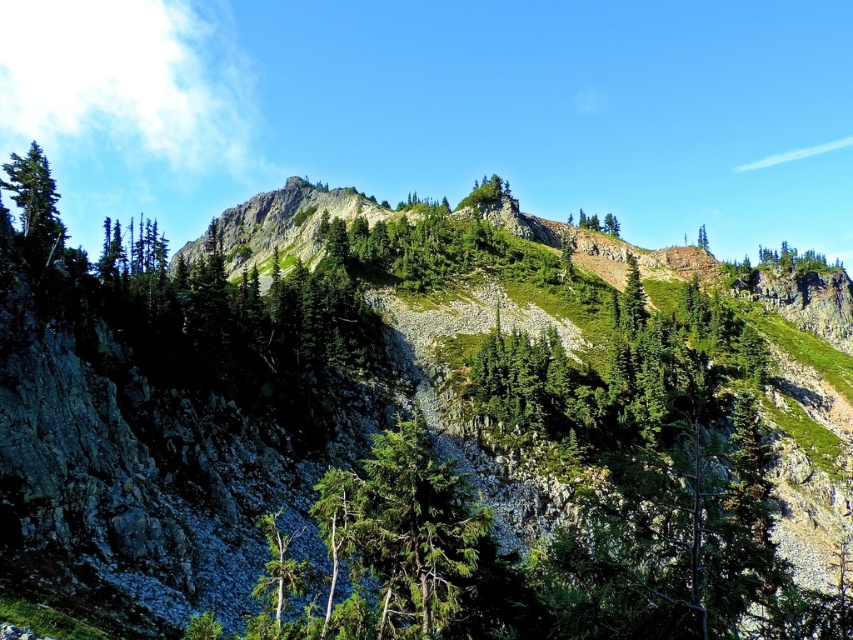
Can you confirm if green matte tree at upper left is positioned to the left of green matte tree at upper center?

Correct, you'll find green matte tree at upper left to the left of green matte tree at upper center.

Does green matte tree at upper left come behind green matte tree at upper center?

No.

Where is `green matte tree at upper left`? This screenshot has height=640, width=853. green matte tree at upper left is located at coordinates (35, 202).

At what (x,y) coordinates should I click in order to perform the action: click on green matte tree at lower center. Please return your answer as a coordinate pair (x, y). The image size is (853, 640). Looking at the image, I should click on (277, 579).

Which is behind, point (282, 556) or point (612, 214)?

The point (612, 214) is behind.

Identify the location of green matte tree at lower center. (277, 579).

Does point (596, 230) lie in front of point (697, 243)?

No, it is behind (697, 243).

Who is lower down, green leafy tree at upper center or green matte tree at upper center?

green matte tree at upper center is lower down.

Is point (584, 220) positioned behind point (703, 225)?

No, (584, 220) is in front of (703, 225).

I want to click on green leafy tree at upper center, so click(598, 224).